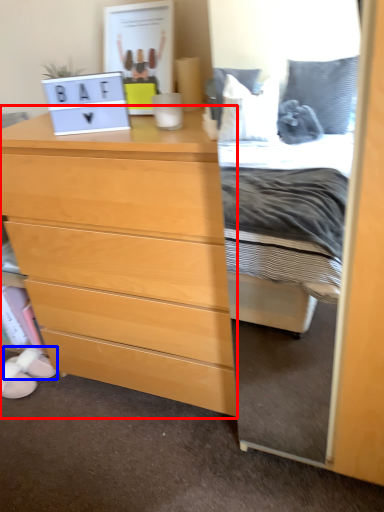
Question: Among these objects, which one is nearest to the camera, chest of drawers (highlighted by a red box) or shoe (highlighted by a blue box)?

Choices:
 (A) chest of drawers
 (B) shoe

Answer: (A)